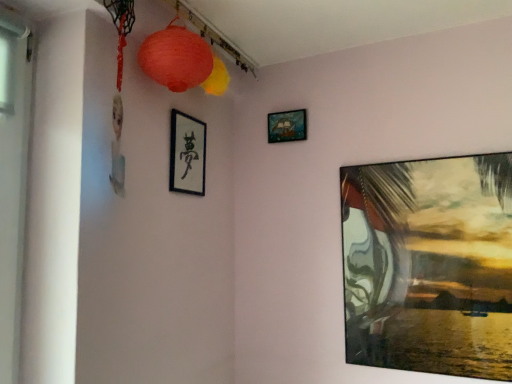
Question: Considering the relative sizes of matte paper lantern at upper center, which is the 2th lantern in back-to-front order, and wooden ship at upper center, acting as the 2th picture frame starting from the left, in the image provided, is matte paper lantern at upper center, which is the 2th lantern in back-to-front order, taller than wooden ship at upper center, acting as the 2th picture frame starting from the left,?

Choices:
 (A) no
 (B) yes

Answer: (B)

Question: Is matte paper lantern at upper center, positioned as the first lantern in front-to-back order, outside wooden ship at upper center, the 1th picture frame positioned from the top?

Choices:
 (A) no
 (B) yes

Answer: (B)

Question: Is matte paper lantern at upper center, which is the 2th lantern in back-to-front order, oriented away from wooden ship at upper center, acting as the 2th picture frame starting from the left?

Choices:
 (A) yes
 (B) no

Answer: (B)

Question: Can you confirm if matte paper lantern at upper center, positioned as the first lantern in front-to-back order, is wider than wooden ship at upper center, the 1th picture frame positioned from the top?

Choices:
 (A) no
 (B) yes

Answer: (B)

Question: Is matte paper lantern at upper center, which is the 2th lantern in back-to-front order, in contact with wooden ship at upper center, the third picture frame positioned from the bottom?

Choices:
 (A) yes
 (B) no

Answer: (B)

Question: Choose the correct answer: Is matte paper lantern at upper center, positioned as the first lantern in front-to-back order, inside black matte picture frame at upper center, acting as the third picture frame starting from the right, or outside it?

Choices:
 (A) outside
 (B) inside

Answer: (A)

Question: Considering the relative positions of matte paper lantern at upper center, positioned as the first lantern in front-to-back order, and black matte picture frame at upper center, which ranks as the 2th picture frame in top-to-bottom order, in the image provided, is matte paper lantern at upper center, positioned as the first lantern in front-to-back order, to the left or to the right of black matte picture frame at upper center, which ranks as the 2th picture frame in top-to-bottom order,?

Choices:
 (A) right
 (B) left

Answer: (A)

Question: From a real-world perspective, is matte paper lantern at upper center, which is the 2th lantern in back-to-front order, positioned above or below black matte picture frame at upper center, which appears as the 2th picture frame when ordered from the bottom?

Choices:
 (A) below
 (B) above

Answer: (B)

Question: From the image's perspective, is matte paper lantern at upper center, which is the 2th lantern in back-to-front order, positioned above or below black matte picture frame at upper center, the first picture frame viewed from the left?

Choices:
 (A) below
 (B) above

Answer: (B)

Question: Is matte paper lantern at upper center, the second lantern positioned from the front, inside or outside of matte paper lantern at upper center, positioned as the first lantern in front-to-back order?

Choices:
 (A) outside
 (B) inside

Answer: (A)

Question: Is point (224, 74) closer or farther from the camera than point (153, 66)?

Choices:
 (A) closer
 (B) farther

Answer: (B)

Question: Considering the positions of matte paper lantern at upper center, the second lantern positioned from the front, and matte paper lantern at upper center, positioned as the first lantern in front-to-back order, in the image, is matte paper lantern at upper center, the second lantern positioned from the front, taller or shorter than matte paper lantern at upper center, positioned as the first lantern in front-to-back order,?

Choices:
 (A) tall
 (B) short

Answer: (B)

Question: Is matte paper lantern at upper center, arranged as the 1th lantern when viewed from the back, to the left or to the right of matte paper lantern at upper center, which is the 2th lantern in back-to-front order, in the image?

Choices:
 (A) right
 (B) left

Answer: (A)

Question: Considering the positions of wooden ship at upper center, the 1th picture frame positioned from the top, and matte paper lantern at upper center, which is the 2th lantern in back-to-front order, in the image, is wooden ship at upper center, the 1th picture frame positioned from the top, wider or thinner than matte paper lantern at upper center, which is the 2th lantern in back-to-front order,?

Choices:
 (A) thin
 (B) wide

Answer: (A)

Question: Is wooden ship at upper center, the 1th picture frame positioned from the top, situated inside matte paper lantern at upper center, which is the 2th lantern in back-to-front order, or outside?

Choices:
 (A) outside
 (B) inside

Answer: (A)